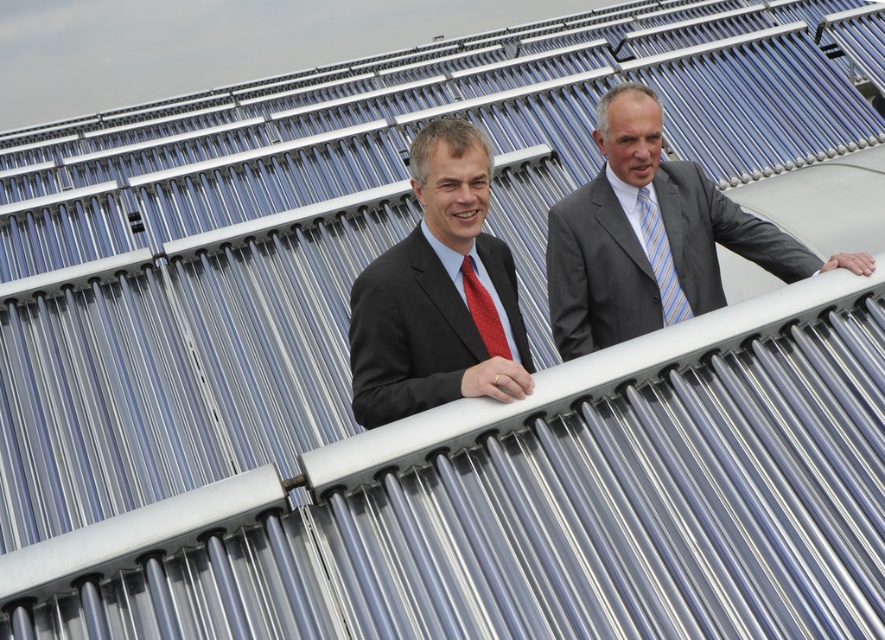
Does matte black suit at center appear over striped silk tie at center?

No, matte black suit at center is not above striped silk tie at center.

Which is behind, point (412, 262) or point (678, 316)?

The point (678, 316) is more distant.

Locate an element on the screen. matte black suit at center is located at coordinates (439, 292).

Does matte black suit at center have a smaller size compared to red dotted fabric tie at center?

No.

Looking at this image, can you confirm if matte black suit at center is positioned to the right of red dotted fabric tie at center?

No, matte black suit at center is not to the right of red dotted fabric tie at center.

Is point (383, 307) less distant than point (494, 312)?

Yes, it is.

Locate an element on the screen. Image resolution: width=885 pixels, height=640 pixels. matte black suit at center is located at coordinates (439, 292).

Which is more to the left, gray suit at center or matte black suit at center?

matte black suit at center is more to the left.

Does gray suit at center have a greater width compared to matte black suit at center?

Correct, the width of gray suit at center exceeds that of matte black suit at center.

Who is more forward, (567, 262) or (352, 317)?

Point (352, 317)

Identify the location of gray suit at center. (652, 237).